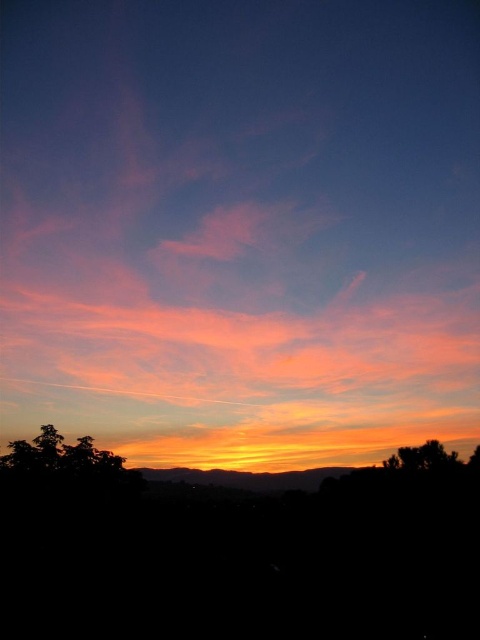
Between pink translucent cloud at upper center and silhouette tree at lower left, which one appears on the left side from the viewer's perspective?

Positioned to the left is silhouette tree at lower left.

Between pink translucent cloud at upper center and silhouette tree at lower left, which one has less height?

With less height is silhouette tree at lower left.

Which is in front, point (321, 262) or point (63, 468)?

Point (63, 468)

Locate an element on the screen. Image resolution: width=480 pixels, height=640 pixels. pink translucent cloud at upper center is located at coordinates (240, 227).

Is pink translucent cloud at upper center smaller than green leafy tree at lower right?

Incorrect, pink translucent cloud at upper center is not smaller in size than green leafy tree at lower right.

Is point (204, 6) less distant than point (435, 440)?

That is False.

Measure the distance between point (397, 177) and camera.

Point (397, 177) and camera are 196.32 meters apart.

Locate an element on the screen. The image size is (480, 640). pink translucent cloud at upper center is located at coordinates point(240,227).

Does silhouette tree at lower left have a greater height compared to green leafy tree at lower right?

No, silhouette tree at lower left is not taller than green leafy tree at lower right.

What do you see at coordinates (60, 456) in the screenshot?
I see `silhouette tree at lower left` at bounding box center [60, 456].

Find the location of a particular element. The width and height of the screenshot is (480, 640). silhouette tree at lower left is located at coordinates pyautogui.click(x=60, y=456).